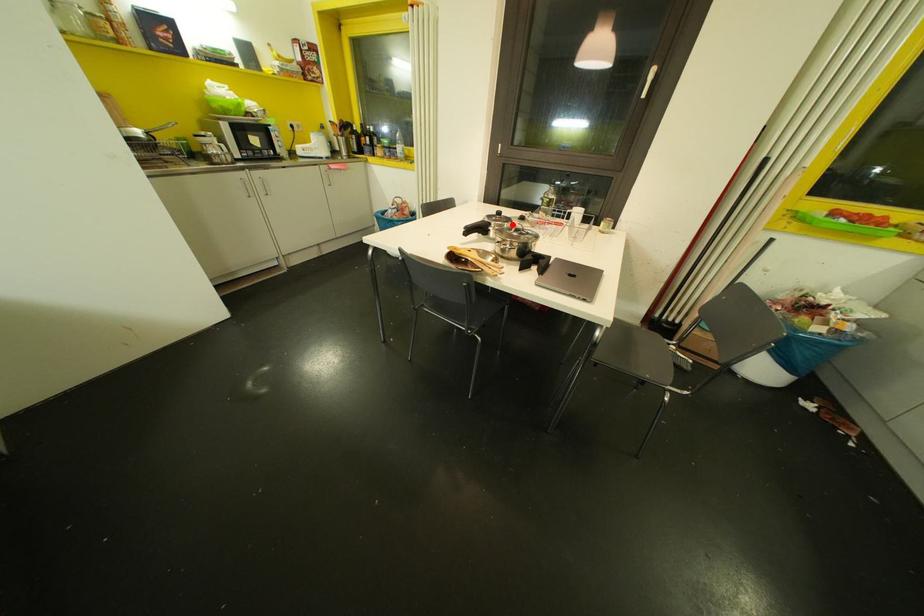
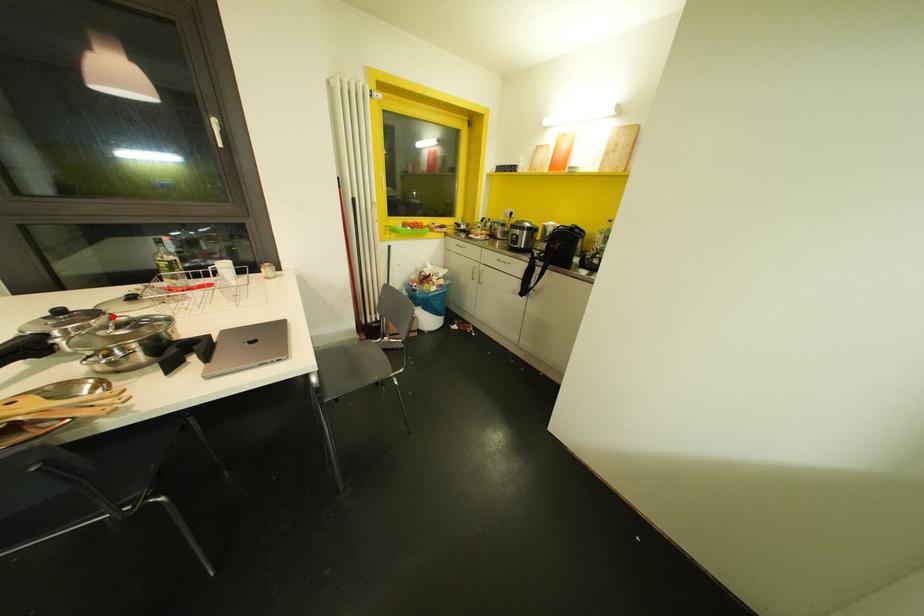
I am providing you with two images of the same scene from different viewpoints. A red point is marked on the first image and another point is marked on the second image. Is the red point in image1 aligned with the point shown in image2?

Yes